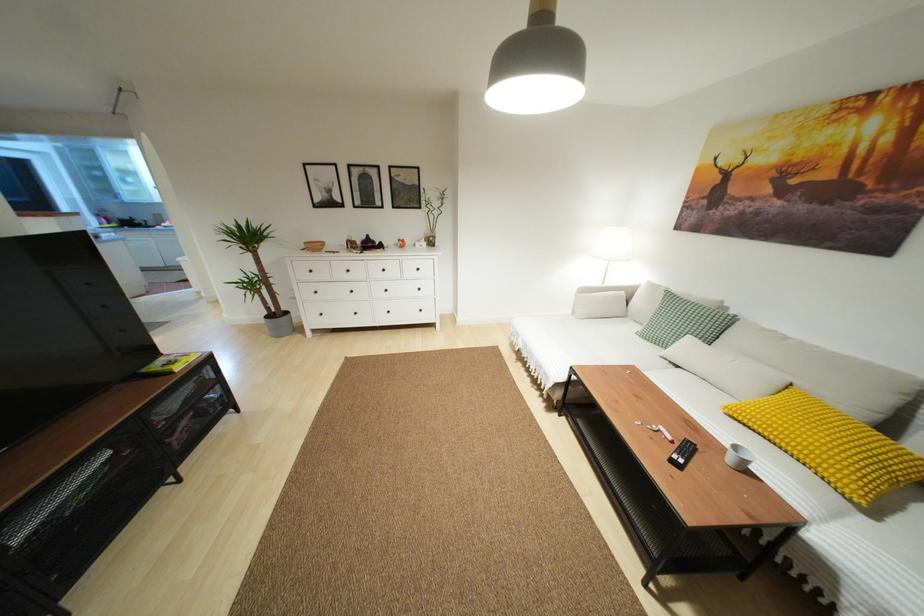
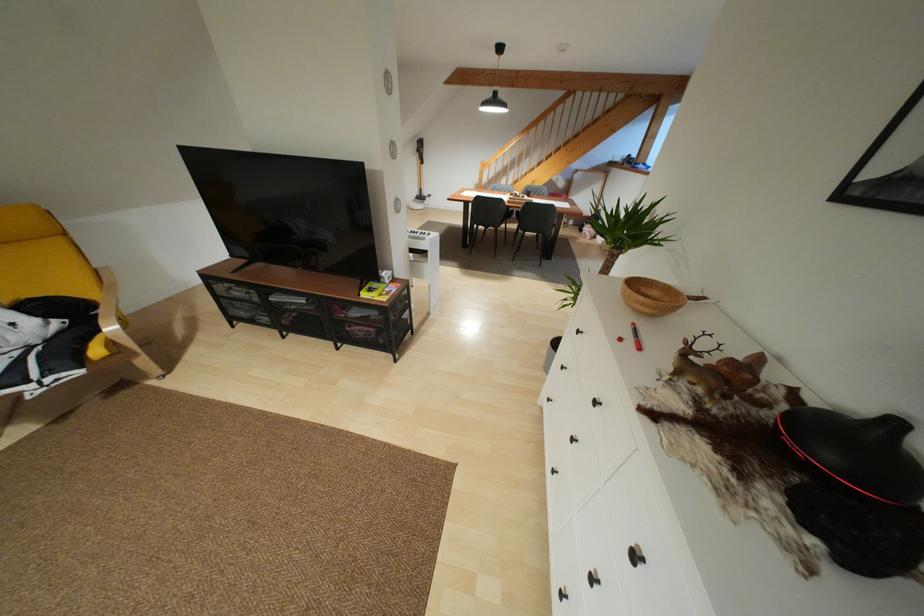
Locate, in the second image, the point that corresponds to pixel 350 291 in the first image.

(572, 439)